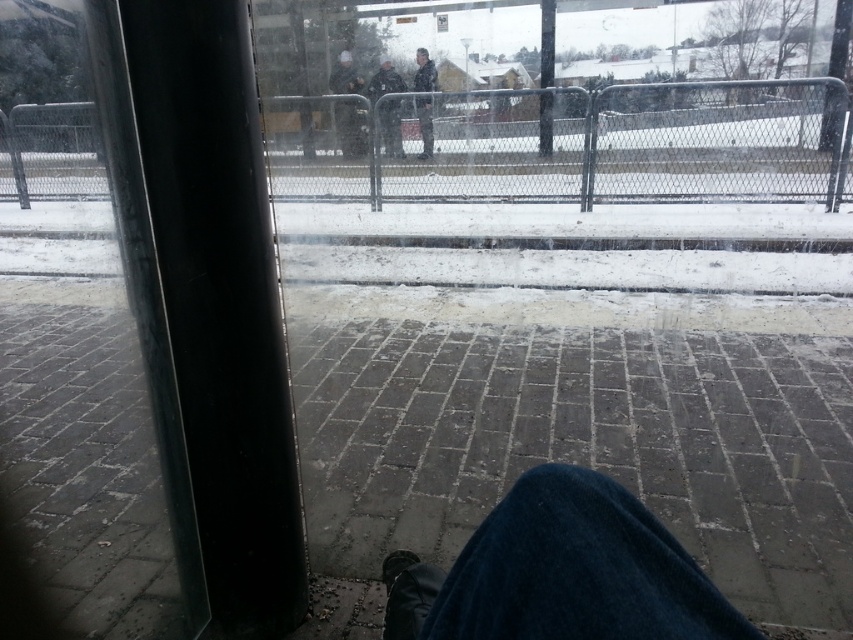
Which is more to the right, dark blue uniform at center or dark gray uniform at center?

dark gray uniform at center

Who is more distant from viewer, (338, 77) or (393, 118)?

The point (338, 77) is behind.

Locate an element on the screen. dark blue uniform at center is located at coordinates (347, 129).

Is point (322, 346) positioned after point (387, 147)?

No, it is in front of (387, 147).

Identify the location of gray concrete pavement at center. The width and height of the screenshot is (853, 640). coord(584,426).

The height and width of the screenshot is (640, 853). In order to click on gray concrete pavement at center in this screenshot , I will do `click(584, 426)`.

Does point (372, 499) come farther from viewer compared to point (346, 141)?

No, (372, 499) is in front of (346, 141).

Does point (686, 403) come closer to viewer compared to point (340, 106)?

Yes, point (686, 403) is in front of point (340, 106).

Who is more forward, (x=743, y=548) or (x=358, y=90)?

Positioned in front is point (x=743, y=548).

The image size is (853, 640). Find the location of `gray concrete pavement at center`. gray concrete pavement at center is located at coordinates (584, 426).